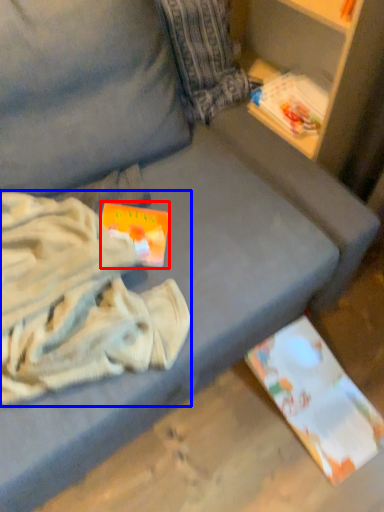
Question: Which object appears farthest to the camera in this image, paperback book (highlighted by a red box) or clothing (highlighted by a blue box)?

Choices:
 (A) paperback book
 (B) clothing

Answer: (A)